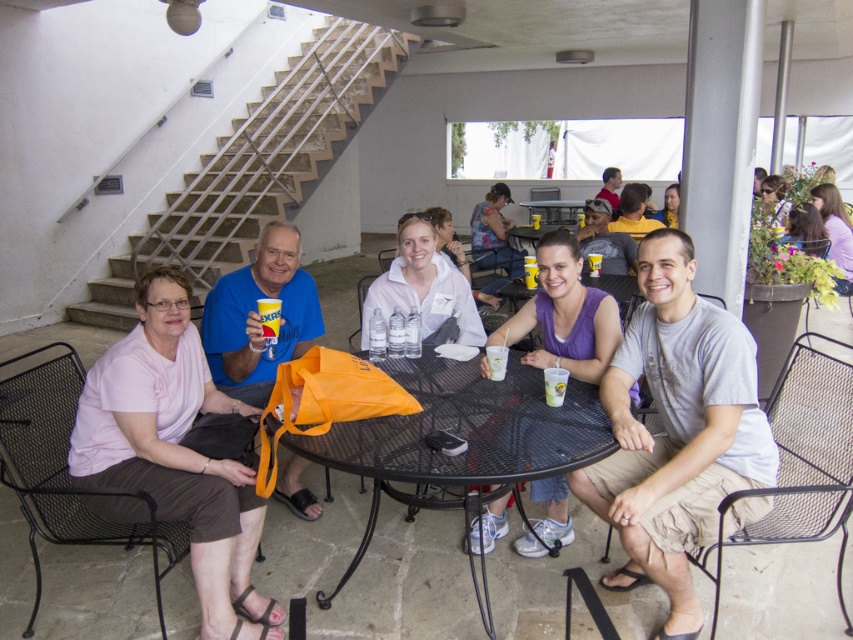
You are standing at the point labeled point (209,291) and want to walk to the point labeled point (706,320). Which direction should you move in?

You should move forward towards the point labeled point (706,320) because it is in front of your current position at point (209,291).

You are at a casual gathering and want to know if the pink fabric shirt at left is taller than the orange fabric bag at center. Can you confirm this based on the scene?

The pink fabric shirt at left has a greater height compared to the orange fabric bag at center, so yes, the pink fabric shirt at left is taller than the orange fabric bag at center.